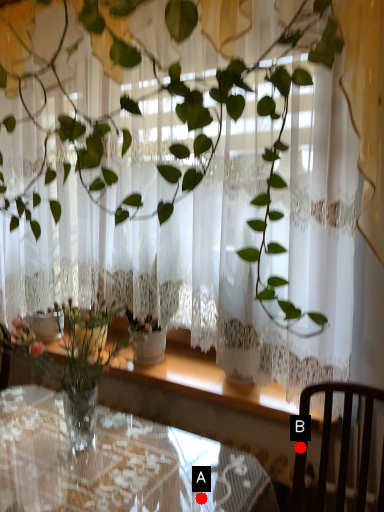
Question: Two points are circled on the image, labeled by A and B beside each circle. Which point is farther to the camera?

Choices:
 (A) A is further
 (B) B is further

Answer: (B)